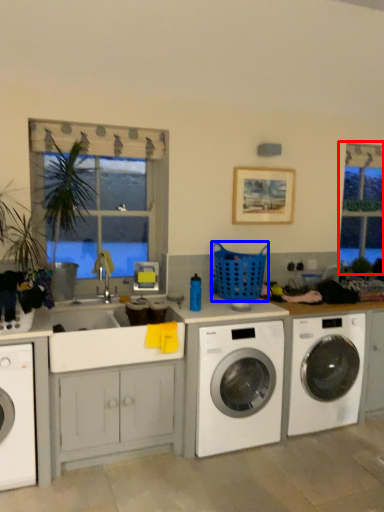
Question: Which object appears farthest to the camera in this image, bay window (highlighted by a red box) or basket (highlighted by a blue box)?

Choices:
 (A) bay window
 (B) basket

Answer: (A)